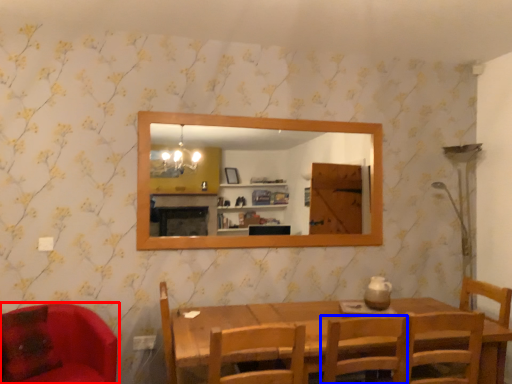
Question: Which object appears closest to the camera in this image, chair (highlighted by a red box) or chair (highlighted by a blue box)?

Choices:
 (A) chair
 (B) chair

Answer: (B)